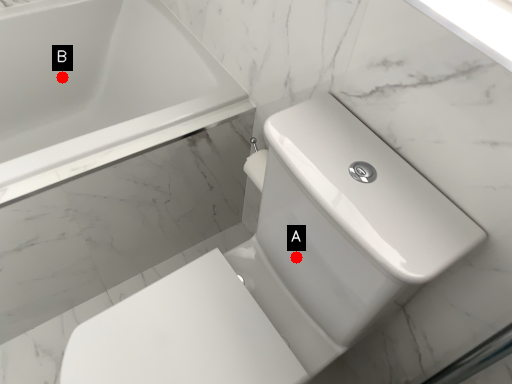
Question: Two points are circled on the image, labeled by A and B beside each circle. Among these points, which one is farthest from the camera?

Choices:
 (A) A is further
 (B) B is further

Answer: (B)